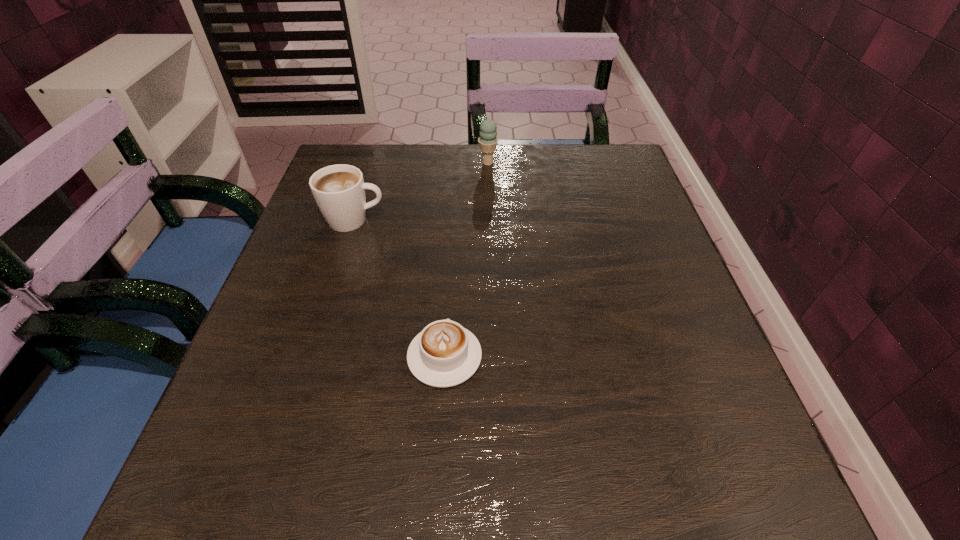
Where is `free location that satisfies the following two spatial constraints: 1. with the handle on the side of the farther cappuccino; 2. with the handle on the right side of the shorter cappuccino`? The image size is (960, 540). free location that satisfies the following two spatial constraints: 1. with the handle on the side of the farther cappuccino; 2. with the handle on the right side of the shorter cappuccino is located at coordinates coord(312,356).

Locate an element on the screen. vacant area that satisfies the following two spatial constraints: 1. with the handle on the side of the left cappuccino; 2. with the handle on the right side of the shortest object is located at coordinates (312, 356).

You are a GUI agent. You are given a task and a screenshot of the screen. Output one action in this format:
    pyautogui.click(x=<x>, y=<y>)
    Task: Click on the free location that satisfies the following two spatial constraints: 1. with the handle on the right side of the shorter cappuccino; 2. on the right side of the ice cream
    This screenshot has width=960, height=540.
    Given the screenshot: What is the action you would take?
    pyautogui.click(x=457, y=163)

Identify the location of free space in the image that satisfies the following two spatial constraints: 1. with the handle on the right side of the nearer cappuccino; 2. on the left side of the ice cream. The image size is (960, 540). (457, 163).

I want to click on free space that satisfies the following two spatial constraints: 1. with the handle on the right side of the ice cream; 2. on the left side of the nearer cappuccino, so click(457, 163).

You are a GUI agent. You are given a task and a screenshot of the screen. Output one action in this format:
    pyautogui.click(x=<x>, y=<y>)
    Task: Click on the vacant area that satisfies the following two spatial constraints: 1. on the front side of the ice cream; 2. with the handle on the side of the farther cappuccino
    The width and height of the screenshot is (960, 540).
    Given the screenshot: What is the action you would take?
    pyautogui.click(x=490, y=220)

At what (x,y) coordinates should I click in order to perform the action: click on vacant region that satisfies the following two spatial constraints: 1. with the handle on the side of the left cappuccino; 2. with the handle on the right side of the right cappuccino. Please return your answer as a coordinate pair (x, y). Image resolution: width=960 pixels, height=540 pixels. Looking at the image, I should click on (312, 356).